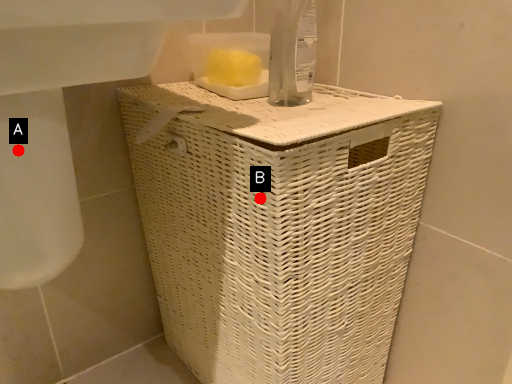
Question: Two points are circled on the image, labeled by A and B beside each circle. Which point is closer to the camera?

Choices:
 (A) A is closer
 (B) B is closer

Answer: (A)